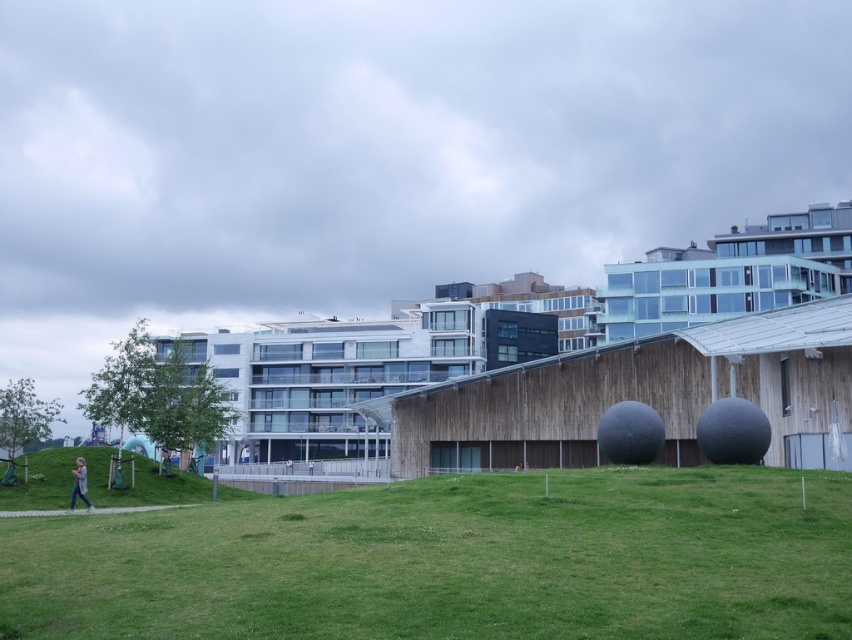
Question: Which object appears farthest from the camera in this image?

Choices:
 (A) light blue jeans at lower left
 (B) green grassy hillside at lower left

Answer: (B)

Question: Can you confirm if green grass at center is wider than light blue jeans at lower left?

Choices:
 (A) no
 (B) yes

Answer: (B)

Question: Estimate the real-world distances between objects in this image. Which object is closer to the green grassy hillside at lower left?

Choices:
 (A) light blue jeans at lower left
 (B) green grass at center

Answer: (A)

Question: Can you confirm if green grassy hillside at lower left is positioned above light blue jeans at lower left?

Choices:
 (A) yes
 (B) no

Answer: (B)

Question: Can you confirm if green grass at center is bigger than light blue jeans at lower left?

Choices:
 (A) no
 (B) yes

Answer: (B)

Question: Estimate the real-world distances between objects in this image. Which object is closer to the light blue jeans at lower left?

Choices:
 (A) green grassy hillside at lower left
 (B) green grass at center

Answer: (A)